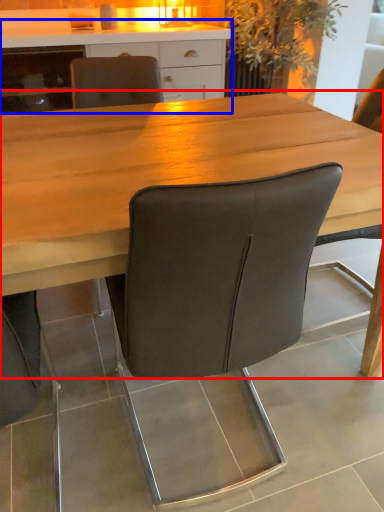
Question: Among these objects, which one is nearest to the camera, table (highlighted by a red box) or cabinetry (highlighted by a blue box)?

Choices:
 (A) table
 (B) cabinetry

Answer: (A)